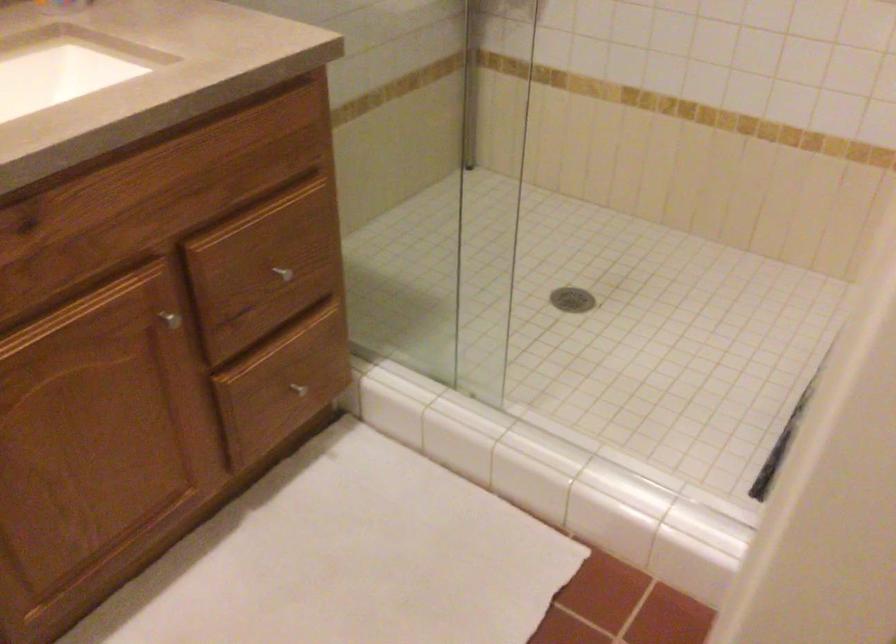
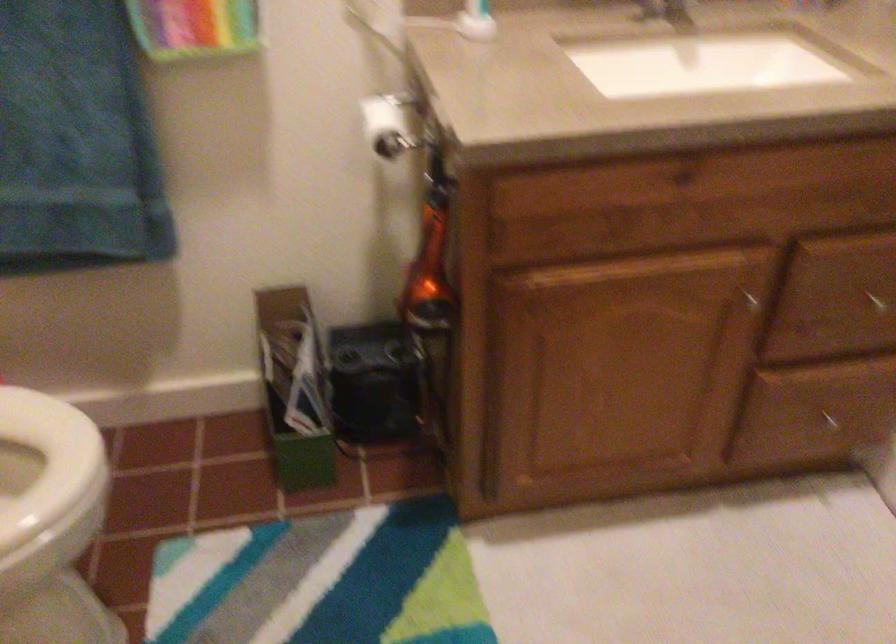
Locate, in the second image, the point that corresponds to (167,303) in the first image.

(752, 285)